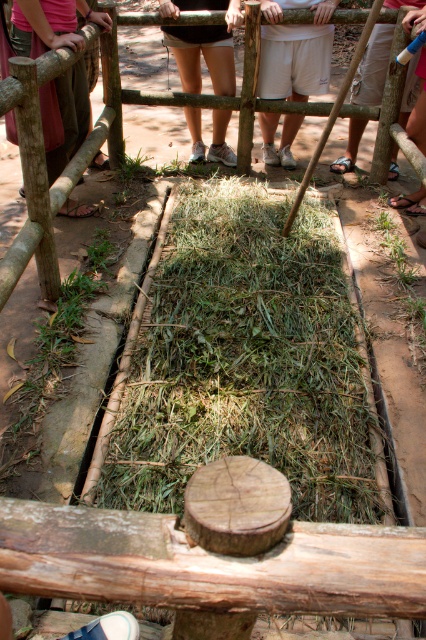
Question: Is white cotton shorts at center smaller than brown wooden fence at center?

Choices:
 (A) yes
 (B) no

Answer: (A)

Question: Which point is closer to the camera?

Choices:
 (A) (66, 22)
 (B) (284, 452)

Answer: (B)

Question: Can you confirm if matte black shorts at center is wider than brown leather sandal at lower right?

Choices:
 (A) no
 (B) yes

Answer: (B)

Question: Is brown wooden fence at center to the right of brown wooden post at center from the viewer's perspective?

Choices:
 (A) yes
 (B) no

Answer: (A)

Question: Which of the following is the closest to the observer?

Choices:
 (A) (11, 92)
 (B) (187, 81)
 (C) (74, 49)
 (D) (199, 417)

Answer: (A)

Question: Among these objects, which one is farthest from the camera?

Choices:
 (A) brown wooden post at center
 (B) matte black shorts at center
 (C) brown leather sandal at lower right
 (D) brown wooden fence at center

Answer: (B)